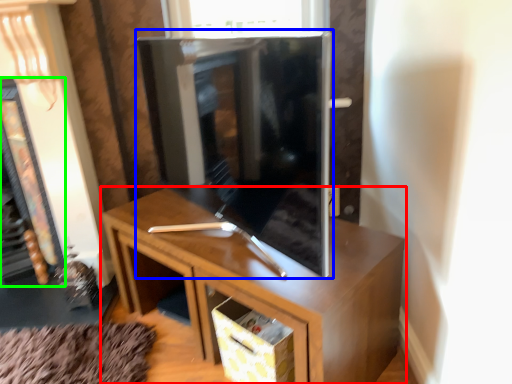
Question: Based on their relative distances, which object is farther from cabinetry (highlighted by a red box)? Choose from tv cabinet (highlighted by a blue box) and fireplace (highlighted by a green box).

Choices:
 (A) tv cabinet
 (B) fireplace

Answer: (B)